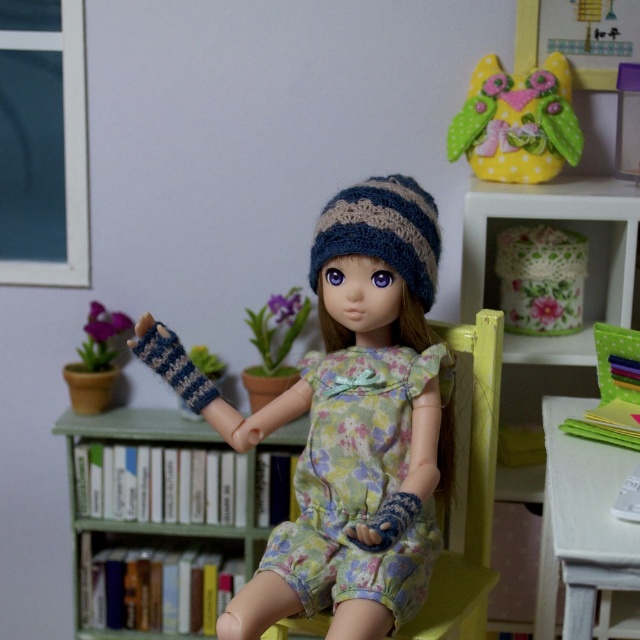
You are arranging decorations for a party and need to place the yellow felt owl at upper right and the purple fabric flower at left. Based on the scene, which decoration is positioned to the right side of the other?

The yellow felt owl at upper right is positioned to the right of the purple fabric flower at left.

You are organizing a small tea party and need to place a teapot on the table. The table is located to the right of the doll. There is a point marked at coordinates (554, 218) which corresponds to a floral fabric basket at upper right. Can you confirm if the table is to the left or right of this basket?

The point at (554, 218) corresponds to the floral fabric basket at upper right. Since the table is to the right of the doll and the basket is at the upper right, the table is likely to the left of the basket.